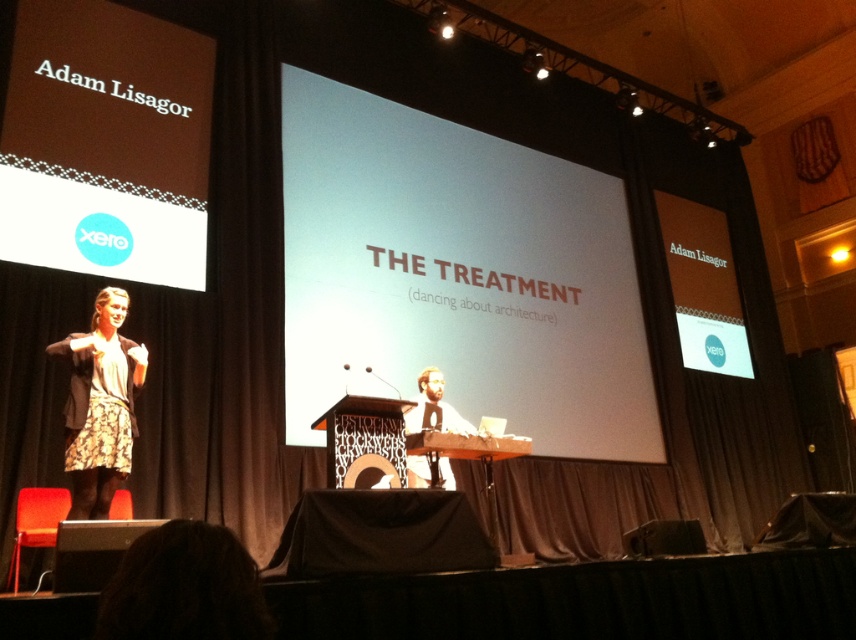
Based on the stage setup, where is the white matte projection screen at center located in terms of coordinates?

The white matte projection screen at center is located at point coordinates of (x=456, y=275).

You are a stagehand setting up for an event. You need to place a 2.5 meter ladder to reach the white matte projection screen at center. Is the ladder long enough to reach the screen?

The white matte projection screen at center is 6.39 meters from camera. The ladder is only 2.5 meters long, so it is not long enough to reach the screen.